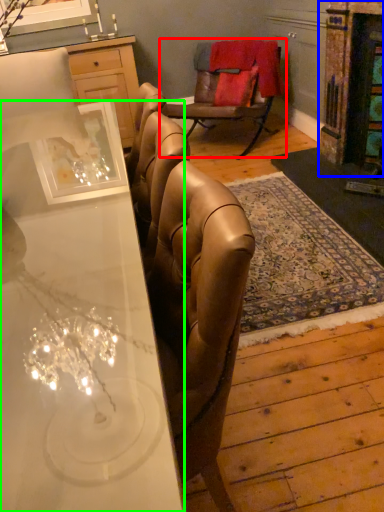
Question: Based on their relative distances, which object is nearer to chair (highlighted by a red box)? Choose from fireplace (highlighted by a blue box) and desk (highlighted by a green box).

Choices:
 (A) fireplace
 (B) desk

Answer: (A)